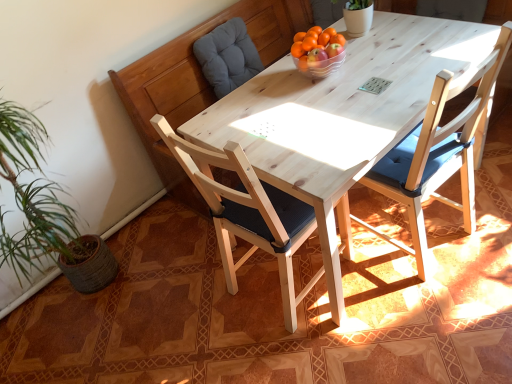
What do you see at coordinates (227, 56) in the screenshot?
I see `gray fabric cushion at upper left` at bounding box center [227, 56].

In order to click on gray fabric cushion at upper left in this screenshot , I will do `click(227, 56)`.

You are a GUI agent. You are given a task and a screenshot of the screen. Output one action in this format:
    pyautogui.click(x=<x>, y=<y>)
    Task: Click on the translucent glass bowl at center
    Image resolution: width=512 pixels, height=384 pixels.
    Given the screenshot: What is the action you would take?
    pyautogui.click(x=320, y=66)

Does gray fabric cushion at upper left have a lesser height compared to light wood chair at center, which is the first chair in right-to-left order?

Indeed, gray fabric cushion at upper left has a lesser height compared to light wood chair at center, which is the first chair in right-to-left order.

From a real-world perspective, is gray fabric cushion at upper left physically located above or below light wood chair at center, the 2th chair viewed from the left?

In terms of real-world spatial position, gray fabric cushion at upper left is above light wood chair at center, the 2th chair viewed from the left.

Is gray fabric cushion at upper left inside or outside of light wood chair at center, which is the first chair in right-to-left order?

gray fabric cushion at upper left is not enclosed by light wood chair at center, which is the first chair in right-to-left order.

Does gray fabric cushion at upper left appear on the left side of light wood chair at center, which is the first chair in right-to-left order?

Indeed, gray fabric cushion at upper left is positioned on the left side of light wood chair at center, which is the first chair in right-to-left order.

Which object is positioned more to the left, natural wood chair at center, which is the 1th chair from left to right, or gray fabric cushion at upper left?

Positioned to the left is gray fabric cushion at upper left.

Considering the relative sizes of natural wood chair at center, which is the 1th chair from left to right, and gray fabric cushion at upper left in the image provided, is natural wood chair at center, which is the 1th chair from left to right, thinner than gray fabric cushion at upper left?

In fact, natural wood chair at center, which is the 1th chair from left to right, might be wider than gray fabric cushion at upper left.

Looking at this image, how different are the orientations of natural wood chair at center, which is the second chair in right-to-left order, and gray fabric cushion at upper left in degrees?

94.6 degrees separate the facing orientations of natural wood chair at center, which is the second chair in right-to-left order, and gray fabric cushion at upper left.

Is there a large distance between natural wood chair at center, which is the 1th chair from left to right, and gray fabric cushion at upper left?

natural wood chair at center, which is the 1th chair from left to right, is positioned a significant distance from gray fabric cushion at upper left.

Considering the positions of objects translucent glass bowl at center and natural wood chair at center, which is the second chair in right-to-left order, in the image provided, who is more to the right, translucent glass bowl at center or natural wood chair at center, which is the second chair in right-to-left order,?

translucent glass bowl at center.

From a real-world perspective, between translucent glass bowl at center and natural wood chair at center, which is the 1th chair from left to right, who is vertically higher?

translucent glass bowl at center is physically above.

Who is more distant, translucent glass bowl at center or natural wood chair at center, which is the second chair in right-to-left order?

translucent glass bowl at center is further away from the camera.

Is gray fabric cushion at upper left outside of natural wood chair at center, which is the 1th chair from left to right?

Absolutely, gray fabric cushion at upper left is external to natural wood chair at center, which is the 1th chair from left to right.

Is gray fabric cushion at upper left closer to camera compared to natural wood chair at center, which is the second chair in right-to-left order?

No, gray fabric cushion at upper left is further to the viewer.

Is gray fabric cushion at upper left bigger or smaller than natural wood chair at center, which is the 1th chair from left to right?

Clearly, gray fabric cushion at upper left is smaller in size than natural wood chair at center, which is the 1th chair from left to right.

Is gray fabric cushion at upper left touching natural wood chair at center, which is the 1th chair from left to right?

They are not placed beside each other.

Choose the correct answer: Is light wood chair at center, the 2th chair viewed from the left, inside gray fabric cushion at upper left or outside it?

light wood chair at center, the 2th chair viewed from the left, is outside gray fabric cushion at upper left.

From the picture: From their relative heights in the image, would you say light wood chair at center, which is the first chair in right-to-left order, is taller or shorter than gray fabric cushion at upper left?

In the image, light wood chair at center, which is the first chair in right-to-left order, appears to be taller than gray fabric cushion at upper left.

From the image's perspective, between light wood chair at center, the 2th chair viewed from the left, and gray fabric cushion at upper left, which one is located above?

gray fabric cushion at upper left appears higher in the image.

Is light wood chair at center, the 2th chair viewed from the left, in front of or behind gray fabric cushion at upper left in the image?

Visually, light wood chair at center, the 2th chair viewed from the left, is located in front of gray fabric cushion at upper left.

Would you say light wood chair at center, the 2th chair viewed from the left, is part of natural wood chair at center, which is the second chair in right-to-left order,'s contents?

That's incorrect, light wood chair at center, the 2th chair viewed from the left, is not inside natural wood chair at center, which is the second chair in right-to-left order.

From a real-world perspective, is natural wood chair at center, which is the second chair in right-to-left order, positioned above or below light wood chair at center, which is the first chair in right-to-left order?

natural wood chair at center, which is the second chair in right-to-left order, is below light wood chair at center, which is the first chair in right-to-left order.

Based on the photo, what's the angular difference between natural wood chair at center, which is the 1th chair from left to right, and light wood chair at center, which is the first chair in right-to-left order,'s facing directions?

They differ by 83.8 degrees in their facing directions.

From the image's perspective, between natural wood chair at center, which is the 1th chair from left to right, and light wood chair at center, which is the first chair in right-to-left order, who is located below?

natural wood chair at center, which is the 1th chair from left to right, is shown below in the image.

Is natural wood chair at center, which is the second chair in right-to-left order, positioned with its back to translucent glass bowl at center?

No.

In terms of height, does natural wood chair at center, which is the second chair in right-to-left order, look taller or shorter compared to translucent glass bowl at center?

Considering their sizes, natural wood chair at center, which is the second chair in right-to-left order, has more height than translucent glass bowl at center.

Between point (290, 273) and point (325, 70), which one is positioned behind?

The point (325, 70) is more distant.

This screenshot has width=512, height=384. There is a gray fabric cushion at upper left. What are the coordinates of `the 1st chair below it (from a real-world perspective)` in the screenshot? It's located at (438, 152).

I want to click on swivel chair that appears on the left of natural wood chair at center, which is the second chair in right-to-left order, so click(x=227, y=56).

Which object lies further to the anchor point natural wood chair at center, which is the 1th chair from left to right, light wood chair at center, the 2th chair viewed from the left, or translucent glass bowl at center?

translucent glass bowl at center lies further to natural wood chair at center, which is the 1th chair from left to right, than the other object.

Which object lies nearer to the anchor point natural wood chair at center, which is the 1th chair from left to right, light wood chair at center, which is the first chair in right-to-left order, or gray fabric cushion at upper left?

light wood chair at center, which is the first chair in right-to-left order, is closer to natural wood chair at center, which is the 1th chair from left to right.

From the image, which object appears to be nearer to translucent glass bowl at center, gray fabric cushion at upper left or natural wood chair at center, which is the 1th chair from left to right?

natural wood chair at center, which is the 1th chair from left to right, is positioned closer to the anchor translucent glass bowl at center.

Which object lies further to the anchor point translucent glass bowl at center, light wood chair at center, the 2th chair viewed from the left, or gray fabric cushion at upper left?

Among the two, gray fabric cushion at upper left is located further to translucent glass bowl at center.

From the image, which object appears to be nearer to translucent glass bowl at center, natural wood chair at center, which is the second chair in right-to-left order, or gray fabric cushion at upper left?

natural wood chair at center, which is the second chair in right-to-left order, lies closer to translucent glass bowl at center than the other object.

From the image, which object appears to be farther from gray fabric cushion at upper left, light wood chair at center, the 2th chair viewed from the left, or translucent glass bowl at center?

light wood chair at center, the 2th chair viewed from the left, is positioned further to the anchor gray fabric cushion at upper left.

Considering their positions, is gray fabric cushion at upper left positioned further to natural wood chair at center, which is the 1th chair from left to right, than light wood chair at center, the 2th chair viewed from the left?

Among the two, gray fabric cushion at upper left is located further to natural wood chair at center, which is the 1th chair from left to right.

Based on their spatial positions, is gray fabric cushion at upper left or translucent glass bowl at center further from light wood chair at center, which is the first chair in right-to-left order?

Based on the image, gray fabric cushion at upper left appears to be further to light wood chair at center, which is the first chair in right-to-left order.

Where is `bowl between natural wood chair at center, which is the second chair in right-to-left order, and gray fabric cushion at upper left from front to back`? This screenshot has width=512, height=384. bowl between natural wood chair at center, which is the second chair in right-to-left order, and gray fabric cushion at upper left from front to back is located at coordinates (320, 66).

Locate an element on the screen. bowl between natural wood chair at center, which is the second chair in right-to-left order, and light wood chair at center, which is the first chair in right-to-left order, from left to right is located at coordinates (320, 66).

Locate an element on the screen. Image resolution: width=512 pixels, height=384 pixels. chair located between natural wood chair at center, which is the 1th chair from left to right, and gray fabric cushion at upper left in the depth direction is located at coordinates (438, 152).

Where is `bowl between light wood chair at center, which is the first chair in right-to-left order, and gray fabric cushion at upper left in the front-back direction`? The image size is (512, 384). bowl between light wood chair at center, which is the first chair in right-to-left order, and gray fabric cushion at upper left in the front-back direction is located at coordinates (320, 66).